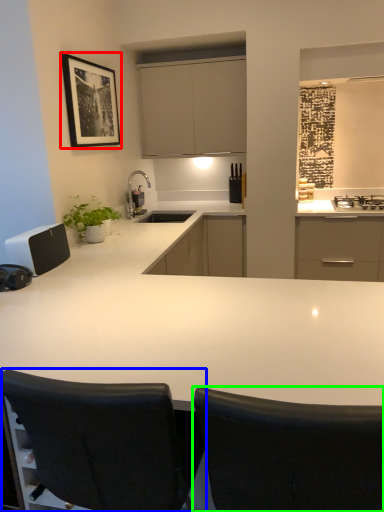
Question: Based on their relative distances, which object is nearer to picture frame (highlighted by a red box)? Choose from chair (highlighted by a blue box) and chair (highlighted by a green box).

Choices:
 (A) chair
 (B) chair

Answer: (A)